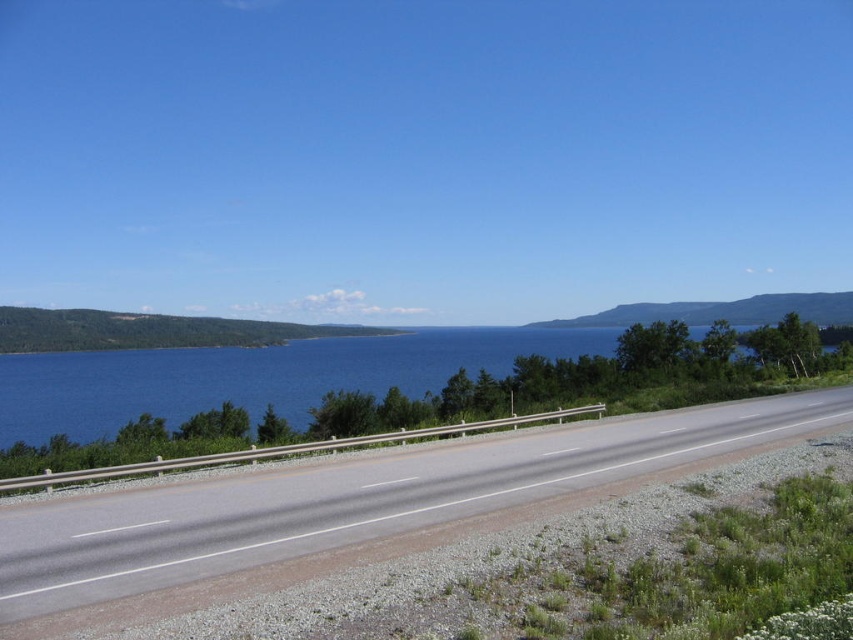
Does asphalt road at center have a greater height compared to blue water at center?

No.

Does asphalt road at center appear under blue water at center?

Indeed, asphalt road at center is positioned under blue water at center.

Is point (102, 554) farther from camera compared to point (26, 381)?

No, it is in front of (26, 381).

Identify the location of asphalt road at center. The width and height of the screenshot is (853, 640). (351, 499).